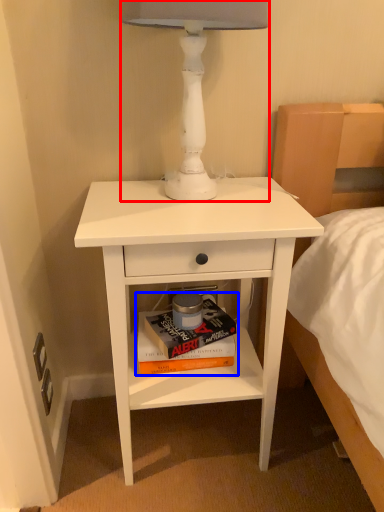
Question: Which object appears farthest to the camera in this image, table lamp (highlighted by a red box) or paperback book (highlighted by a blue box)?

Choices:
 (A) table lamp
 (B) paperback book

Answer: (B)